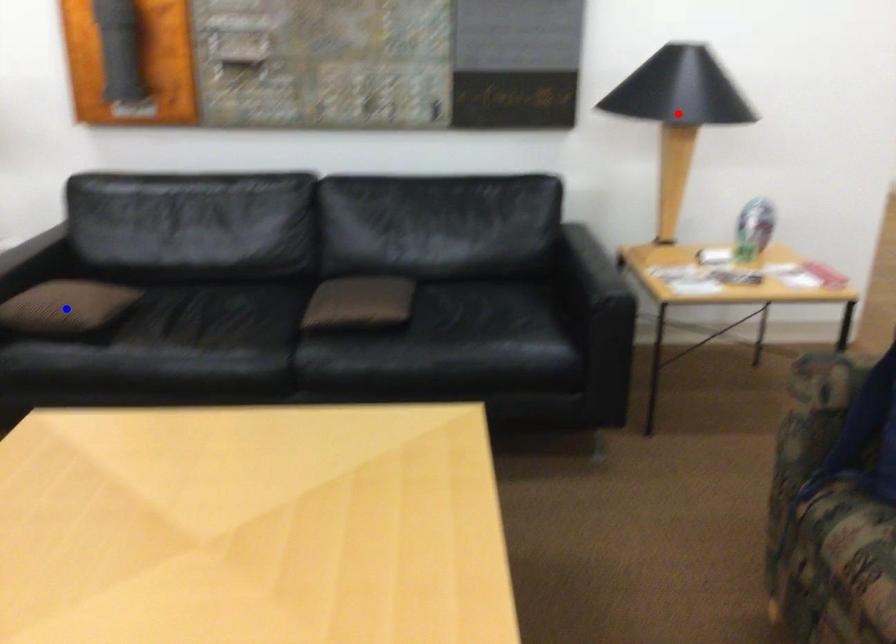
Question: Which of the two points in the image is closer to the camera?

Choices:
 (A) Blue point is closer.
 (B) Red point is closer.

Answer: (A)